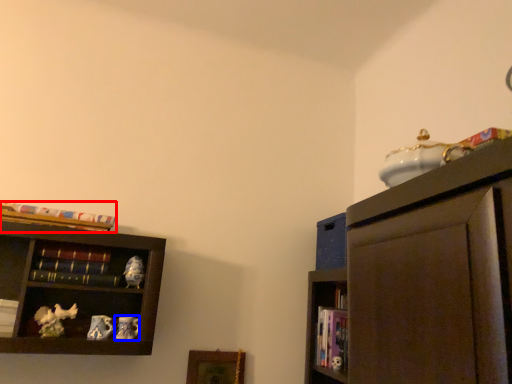
Question: Among these objects, which one is farthest to the camera, book (highlighted by a red box) or toy (highlighted by a blue box)?

Choices:
 (A) book
 (B) toy

Answer: (B)